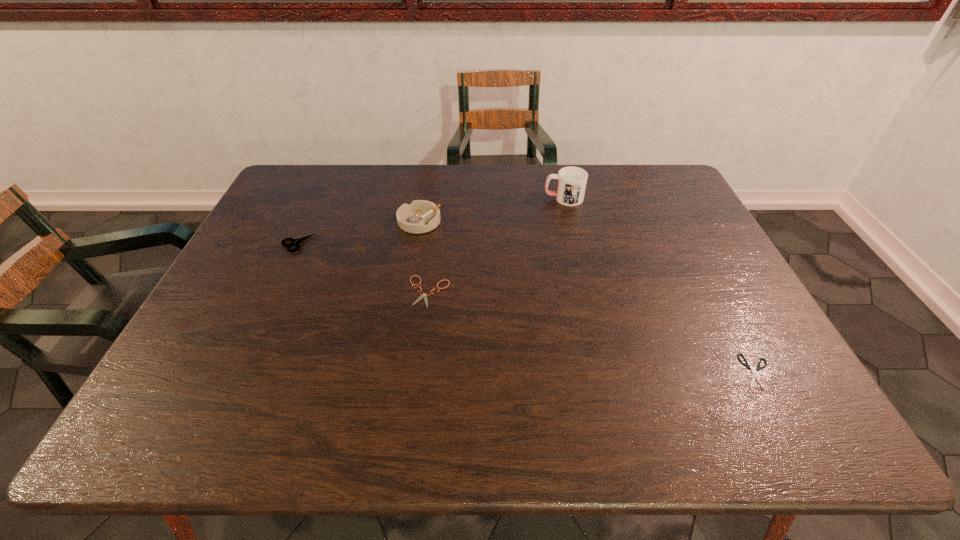
At what (x,y) coordinates should I click in order to perform the action: click on mug. Please return your answer as a coordinate pair (x, y). The height and width of the screenshot is (540, 960). Looking at the image, I should click on (571, 181).

Find the location of a particular element. the farthest object is located at coordinates (571, 181).

Locate an element on the screen. Image resolution: width=960 pixels, height=540 pixels. ashtray is located at coordinates (421, 216).

Image resolution: width=960 pixels, height=540 pixels. I want to click on the tallest shears, so [x=294, y=242].

Locate an element on the screen. The image size is (960, 540). the farthest shears is located at coordinates (294, 242).

Identify the location of the second nearest shears. (424, 295).

The height and width of the screenshot is (540, 960). I want to click on the second shortest shears, so click(x=424, y=295).

Where is `the rightmost object`? the rightmost object is located at coordinates (747, 365).

Identify the location of the nearest shears. The image size is (960, 540). (747, 365).

Locate an element on the screen. blank space located 0.170m on the side of the mug with the handle is located at coordinates (492, 198).